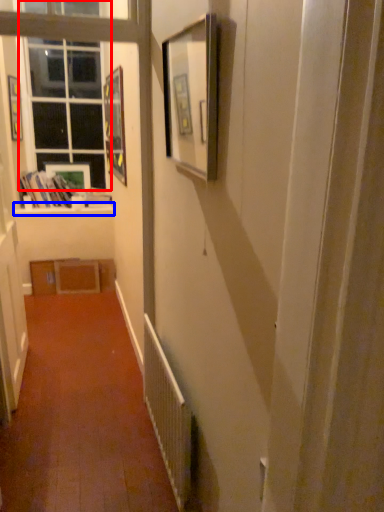
Question: Which object is further to the camera taking this photo, window (highlighted by a red box) or window sill (highlighted by a blue box)?

Choices:
 (A) window
 (B) window sill

Answer: (B)